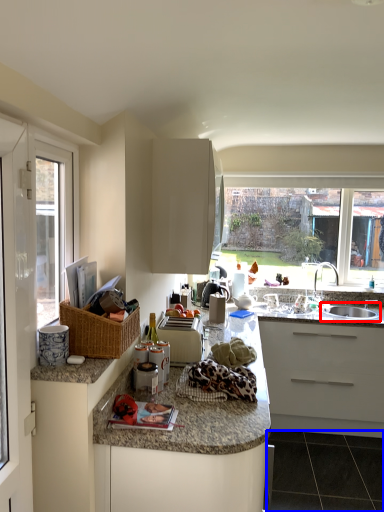
Question: Which of the following is the closest to the observer, sink (highlighted by a red box) or granite (highlighted by a blue box)?

Choices:
 (A) sink
 (B) granite

Answer: (B)